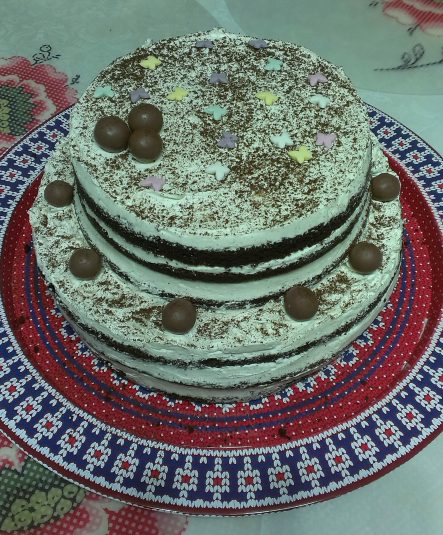
This screenshot has width=443, height=535. Identify the location of flower print on table. (28, 100), (418, 17).